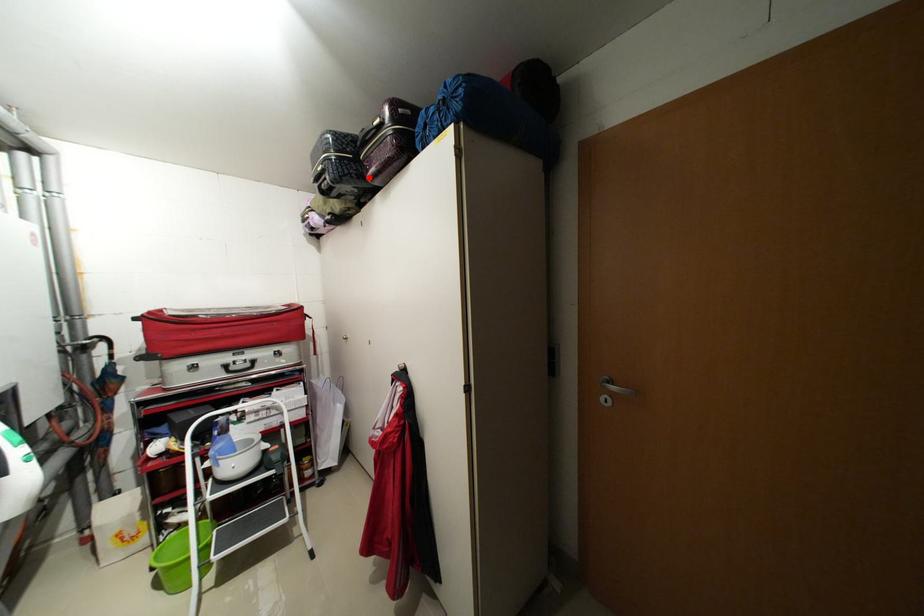
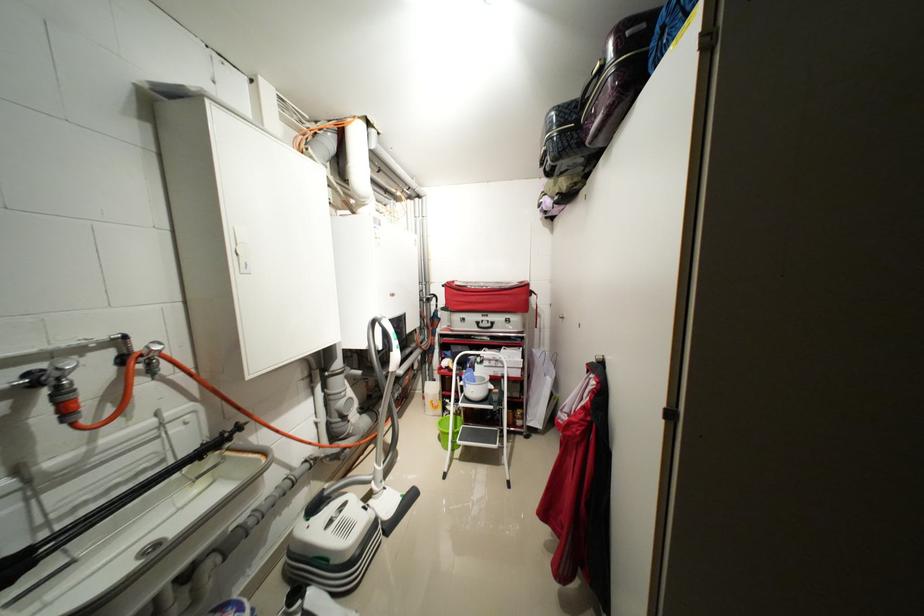
Question: I am providing you with two images of the same scene from different viewpoints. A red point is marked on the first image. Can you still see the location of the red point in image 2?

Choices:
 (A) Yes
 (B) No

Answer: (A)